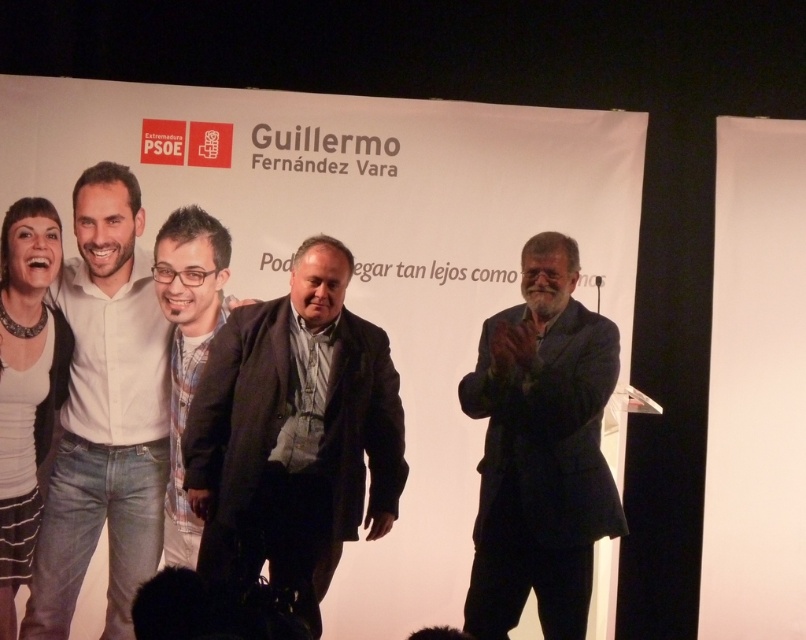
Between dark blue suit at right and white shirt at left, which one has less height?

dark blue suit at right

Who is positioned more to the left, dark blue suit at right or white shirt at left?

Positioned to the left is white shirt at left.

Identify the location of dark blue suit at right. The height and width of the screenshot is (640, 806). tap(539, 449).

Is dark blue suit at right thinner than matte black jacket at center?

No.

Which of these two, dark blue suit at right or matte black jacket at center, stands taller?

With more height is matte black jacket at center.

This screenshot has width=806, height=640. In order to click on dark blue suit at right in this screenshot , I will do `click(539, 449)`.

Who is higher up, dark brown textured jacket at center or white shirt at left?

white shirt at left is above.

Can you confirm if dark brown textured jacket at center is positioned to the right of white shirt at left?

Correct, you'll find dark brown textured jacket at center to the right of white shirt at left.

Describe the element at coordinates (293, 433) in the screenshot. I see `dark brown textured jacket at center` at that location.

At what (x,y) coordinates should I click in order to perform the action: click on dark brown textured jacket at center. Please return your answer as a coordinate pair (x, y). Looking at the image, I should click on (293, 433).